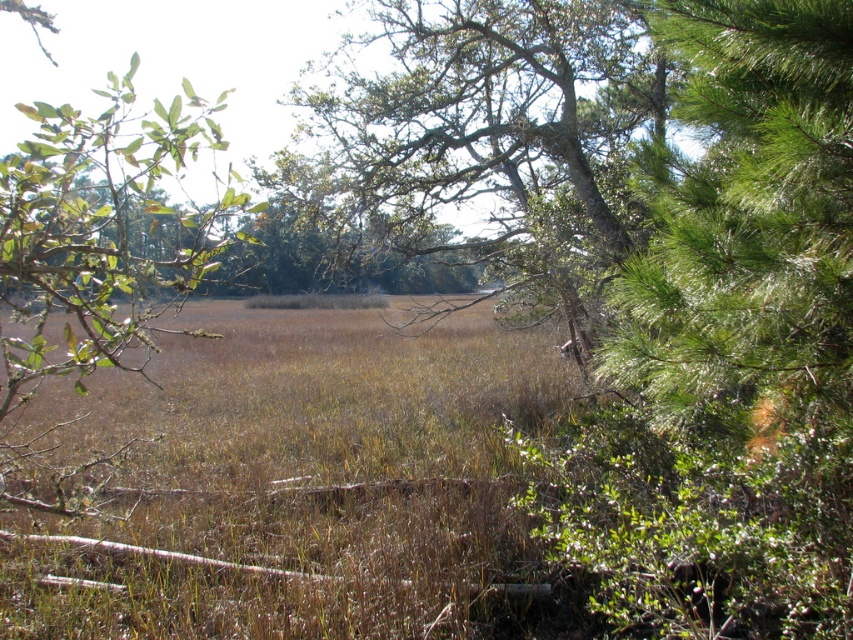
Is green needle-like at right wider than green leafy tree at center?

No, green needle-like at right is not wider than green leafy tree at center.

Consider the image. Who is lower down, green needle-like at right or green leafy tree at center?

Positioned lower is green needle-like at right.

Where is `green needle-like at right`? The height and width of the screenshot is (640, 853). green needle-like at right is located at coordinates (747, 227).

Locate an element on the screen. green needle-like at right is located at coordinates (747, 227).